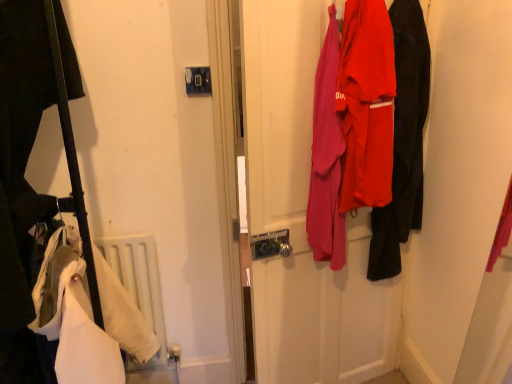
Question: In the image, is white matte radiator at lower left on the left side or the right side of matte fabric coats at center?

Choices:
 (A) left
 (B) right

Answer: (A)

Question: Looking at the image, does white matte radiator at lower left seem bigger or smaller compared to matte fabric coats at center?

Choices:
 (A) big
 (B) small

Answer: (B)

Question: Which of these objects is positioned closest to the white matte radiator at lower left?

Choices:
 (A) white fabric at left
 (B) matte black jacket at right
 (C) matte fabric coats at center

Answer: (A)

Question: Which object is the closest to the matte black jacket at right?

Choices:
 (A) matte fabric coats at center
 (B) white fabric at left
 (C) white matte radiator at lower left

Answer: (A)